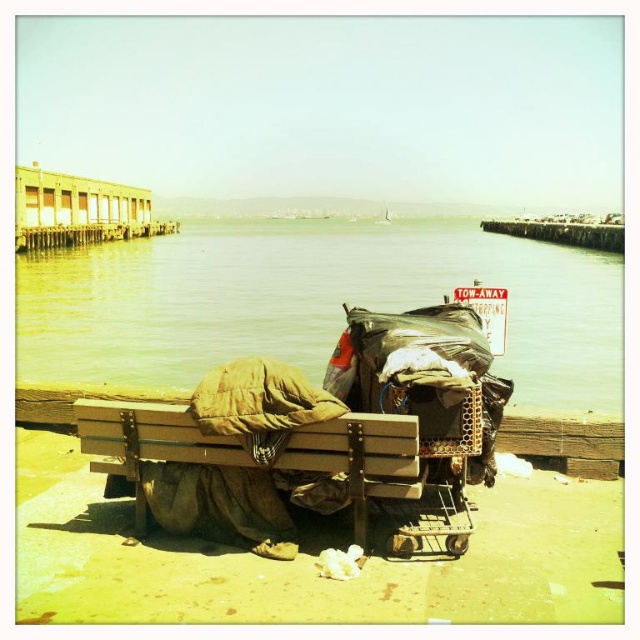
Is clear water at bench left smaller than brown wooden bench at lower center?

Actually, clear water at bench left might be larger than brown wooden bench at lower center.

Does point (340, 314) come in front of point (332, 428)?

No.

Find the location of a particular element. The image size is (640, 640). clear water at bench left is located at coordinates (310, 301).